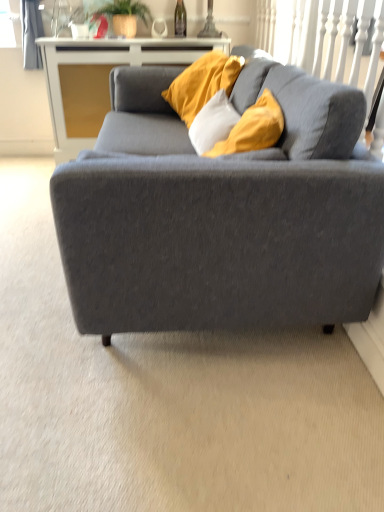
Identify the location of green leafy plant at upper center. The height and width of the screenshot is (512, 384). (124, 16).

Describe the element at coordinates (101, 80) in the screenshot. I see `white glossy cabinet at upper center` at that location.

What are the coordinates of `white glossy cabinet at upper center` in the screenshot? It's located at (101, 80).

The height and width of the screenshot is (512, 384). What do you see at coordinates (211, 228) in the screenshot?
I see `matte gray couch at center` at bounding box center [211, 228].

The image size is (384, 512). In order to click on green glass wine bottle at upper center in this screenshot , I will do `click(180, 19)`.

Locate an element on the screen. green leafy plant at upper center is located at coordinates (124, 16).

Can you confirm if green glass wine bottle at upper center is taller than white glossy cabinet at upper center?

Incorrect, the height of green glass wine bottle at upper center is not larger of that of white glossy cabinet at upper center.

Locate an element on the screen. wine bottle on the right of white glossy cabinet at upper center is located at coordinates (180, 19).

Does point (177, 10) come behind point (102, 48)?

Yes, point (177, 10) is behind point (102, 48).

Is white glossy cabinet at upper center located within green glass wine bottle at upper center?

Actually, white glossy cabinet at upper center is outside green glass wine bottle at upper center.

Is point (178, 16) less distant than point (130, 293)?

That is False.

In the scene shown: Which of these two, green glass wine bottle at upper center or matte gray couch at center, stands taller?

Standing taller between the two is matte gray couch at center.

Is the depth of green glass wine bottle at upper center less than that of matte gray couch at center?

No, green glass wine bottle at upper center is further to the viewer.

Is green glass wine bottle at upper center not inside matte gray couch at center?

That's correct, green glass wine bottle at upper center is outside of matte gray couch at center.

Can you confirm if matte gray couch at center is taller than white glossy cabinet at upper center?

Indeed, matte gray couch at center has a greater height compared to white glossy cabinet at upper center.

Is matte gray couch at center touching white glossy cabinet at upper center?

No, matte gray couch at center is not with white glossy cabinet at upper center.

Consider the image. Could you tell me if matte gray couch at center is turned towards white glossy cabinet at upper center?

No, matte gray couch at center is not facing towards white glossy cabinet at upper center.

Which object is closer to the camera, matte gray couch at center or white glossy cabinet at upper center?

matte gray couch at center is more forward.

From a real-world perspective, is white glossy cabinet at upper center over green glass wine bottle at upper center?

No, from a real-world perspective, white glossy cabinet at upper center is not on top of green glass wine bottle at upper center.

Considering the relative positions of white glossy cabinet at upper center and green glass wine bottle at upper center in the image provided, is white glossy cabinet at upper center to the right of green glass wine bottle at upper center from the viewer's perspective?

Incorrect, white glossy cabinet at upper center is not on the right side of green glass wine bottle at upper center.

How many degrees apart are the facing directions of white glossy cabinet at upper center and green glass wine bottle at upper center?

The angle between the facing direction of white glossy cabinet at upper center and the facing direction of green glass wine bottle at upper center is 0.732 degrees.

Is white glossy cabinet at upper center not close to green glass wine bottle at upper center?

They are positioned close to each other.

Which object is positioned more to the left, matte gray couch at center or green glass wine bottle at upper center?

green glass wine bottle at upper center is more to the left.

Does matte gray couch at center have a lesser width compared to green glass wine bottle at upper center?

No, matte gray couch at center is not thinner than green glass wine bottle at upper center.

From the picture: Does matte gray couch at center have a smaller size compared to green glass wine bottle at upper center?

No.

From a real-world perspective, is matte gray couch at center located beneath green leafy plant at upper center?

Yes, from a real-world perspective, matte gray couch at center is under green leafy plant at upper center.

Could you tell me if matte gray couch at center is facing green leafy plant at upper center?

No, matte gray couch at center is not oriented towards green leafy plant at upper center.

Are matte gray couch at center and green leafy plant at upper center far apart?

Absolutely, matte gray couch at center is distant from green leafy plant at upper center.

From the image's perspective, is white glossy cabinet at upper center under green leafy plant at upper center?

Indeed, from the image's perspective, white glossy cabinet at upper center is shown beneath green leafy plant at upper center.

Is white glossy cabinet at upper center to the left or to the right of green leafy plant at upper center in the image?

Clearly, white glossy cabinet at upper center is on the right of green leafy plant at upper center in the image.

Is white glossy cabinet at upper center smaller than green leafy plant at upper center?

Incorrect, white glossy cabinet at upper center is not smaller in size than green leafy plant at upper center.

Who is taller, white glossy cabinet at upper center or green leafy plant at upper center?

With more height is white glossy cabinet at upper center.

Locate an element on the screen. This screenshot has width=384, height=512. table located below the green glass wine bottle at upper center (from the image's perspective) is located at coordinates (101, 80).

The height and width of the screenshot is (512, 384). There is a matte gray couch at center. What are the coordinates of `wine bottle above it (from a real-world perspective)` in the screenshot? It's located at (180, 19).

When comparing their distances from matte gray couch at center, does white glossy cabinet at upper center or green glass wine bottle at upper center seem closer?

white glossy cabinet at upper center lies closer to matte gray couch at center than the other object.

In the scene shown: Which object lies nearer to the anchor point green glass wine bottle at upper center, white glossy cabinet at upper center or matte gray couch at center?

The object closer to green glass wine bottle at upper center is white glossy cabinet at upper center.

From the image, which object appears to be farther from green glass wine bottle at upper center, matte gray couch at center or green leafy plant at upper center?

matte gray couch at center is positioned further to the anchor green glass wine bottle at upper center.

From the image, which object appears to be nearer to green leafy plant at upper center, matte gray couch at center or green glass wine bottle at upper center?

green glass wine bottle at upper center is positioned closer to the anchor green leafy plant at upper center.

Looking at the image, which one is located further to green leafy plant at upper center, white glossy cabinet at upper center or matte gray couch at center?

matte gray couch at center.

Considering their positions, is green leafy plant at upper center positioned further to matte gray couch at center than white glossy cabinet at upper center?

green leafy plant at upper center lies further to matte gray couch at center than the other object.

Looking at the image, which one is located further to white glossy cabinet at upper center, green glass wine bottle at upper center or matte gray couch at center?

matte gray couch at center is positioned further to the anchor white glossy cabinet at upper center.

Based on their spatial positions, is matte gray couch at center or white glossy cabinet at upper center closer to green glass wine bottle at upper center?

Based on the image, white glossy cabinet at upper center appears to be nearer to green glass wine bottle at upper center.

Locate an element on the screen. plant between green glass wine bottle at upper center and white glossy cabinet at upper center vertically is located at coordinates (124, 16).

Locate an element on the screen. table located between matte gray couch at center and green glass wine bottle at upper center in the depth direction is located at coordinates (101, 80).

What are the coordinates of `plant between matte gray couch at center and white glossy cabinet at upper center from front to back` in the screenshot? It's located at (124, 16).

Where is `plant between matte gray couch at center and green glass wine bottle at upper center along the z-axis`? plant between matte gray couch at center and green glass wine bottle at upper center along the z-axis is located at coordinates (124, 16).